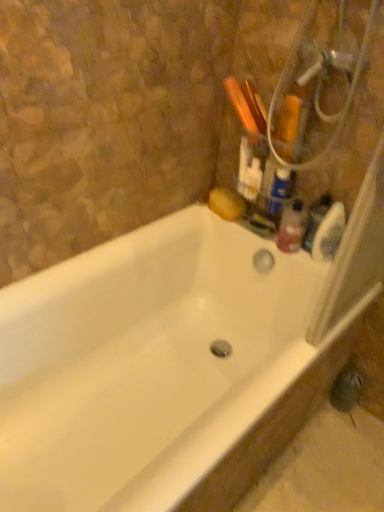
Question: Considering the relative positions of translucent plastic soap dispenser at upper right and translucent plastic bottle at upper right, marked as the second cleaning product in a bottom-to-top arrangement, in the image provided, is translucent plastic soap dispenser at upper right to the right of translucent plastic bottle at upper right, marked as the second cleaning product in a bottom-to-top arrangement, from the viewer's perspective?

Choices:
 (A) yes
 (B) no

Answer: (A)

Question: Is translucent plastic soap dispenser at upper right shorter than translucent plastic bottle at upper right, marked as the second cleaning product in a bottom-to-top arrangement?

Choices:
 (A) yes
 (B) no

Answer: (B)

Question: Can you confirm if translucent plastic soap dispenser at upper right is thinner than translucent plastic bottle at upper right, which ranks as the 1th cleaning product in top-to-bottom order?

Choices:
 (A) yes
 (B) no

Answer: (B)

Question: Are translucent plastic soap dispenser at upper right and translucent plastic bottle at upper right, marked as the second cleaning product in a bottom-to-top arrangement, making contact?

Choices:
 (A) no
 (B) yes

Answer: (A)

Question: Does translucent plastic soap dispenser at upper right have a greater height compared to translucent plastic bottle at upper right, marked as the second cleaning product in a bottom-to-top arrangement?

Choices:
 (A) no
 (B) yes

Answer: (B)

Question: Is point (243, 375) positioned closer to the camera than point (289, 195)?

Choices:
 (A) farther
 (B) closer

Answer: (B)

Question: Considering their positions, is white glossy bathtub at upper right located in front of or behind translucent plastic bottle at upper right, which ranks as the 1th cleaning product in top-to-bottom order?

Choices:
 (A) behind
 (B) front

Answer: (B)

Question: Would you say white glossy bathtub at upper right is inside or outside translucent plastic bottle at upper right, marked as the second cleaning product in a bottom-to-top arrangement?

Choices:
 (A) outside
 (B) inside

Answer: (A)

Question: Is white glossy bathtub at upper right wider or thinner than translucent plastic bottle at upper right, marked as the second cleaning product in a bottom-to-top arrangement?

Choices:
 (A) wide
 (B) thin

Answer: (A)

Question: Is translucent plastic bottle at upper right, marked as the second cleaning product in a bottom-to-top arrangement, inside or outside of white glossy bathtub at upper right?

Choices:
 (A) inside
 (B) outside

Answer: (B)

Question: Based on their sizes in the image, would you say translucent plastic bottle at upper right, which ranks as the 1th cleaning product in top-to-bottom order, is bigger or smaller than white glossy bathtub at upper right?

Choices:
 (A) small
 (B) big

Answer: (A)

Question: Is point [x=274, y=198] closer or farther from the camera than point [x=188, y=224]?

Choices:
 (A) farther
 (B) closer

Answer: (B)

Question: Is translucent plastic bottle at upper right, which ranks as the 1th cleaning product in top-to-bottom order, taller or shorter than white glossy bathtub at upper right?

Choices:
 (A) tall
 (B) short

Answer: (B)

Question: Is translucent plastic soap dispenser at upper right in front of or behind white glossy bathtub at upper right in the image?

Choices:
 (A) front
 (B) behind

Answer: (B)

Question: From their relative heights in the image, would you say translucent plastic soap dispenser at upper right is taller or shorter than white glossy bathtub at upper right?

Choices:
 (A) tall
 (B) short

Answer: (B)